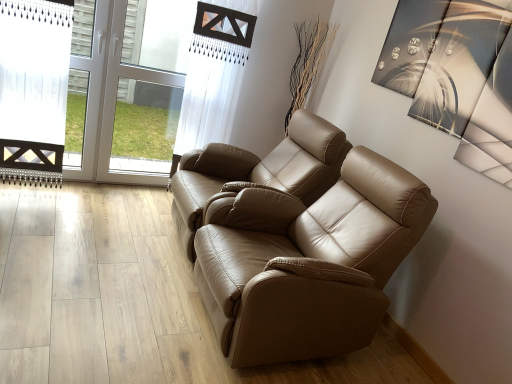
Image resolution: width=512 pixels, height=384 pixels. What are the coordinates of `free space to the left of tan leather sofa at center, which is the second chair in back-to-front order` in the screenshot? It's located at (114, 299).